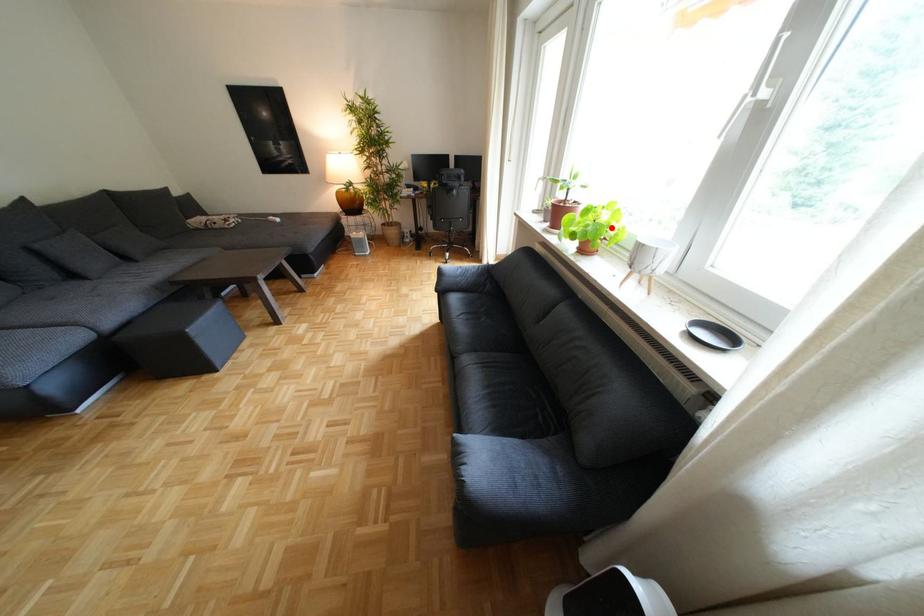
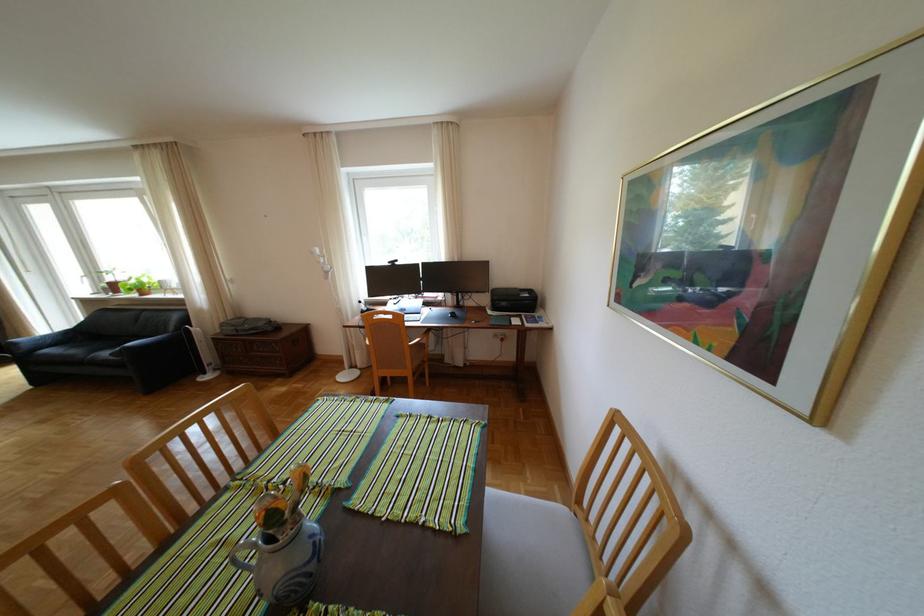
Question: I am providing you with two images of the same scene from different viewpoints. Given a red point in image1, look at the same physical point in image2. Is it:

Choices:
 (A) Closer to the viewpoint
 (B) Farther from the viewpoint

Answer: (B)